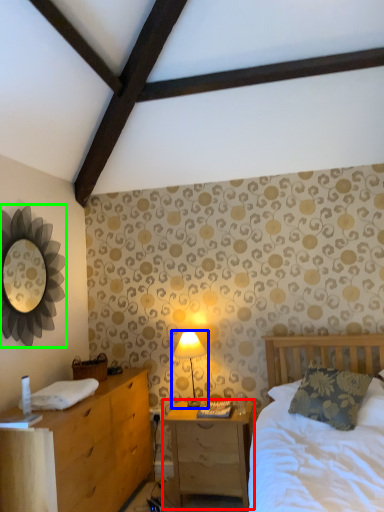
Question: Considering the real-world distances, which object is farthest from nightstand (highlighted by a red box)? table lamp (highlighted by a blue box) or mirror (highlighted by a green box)?

Choices:
 (A) table lamp
 (B) mirror

Answer: (B)